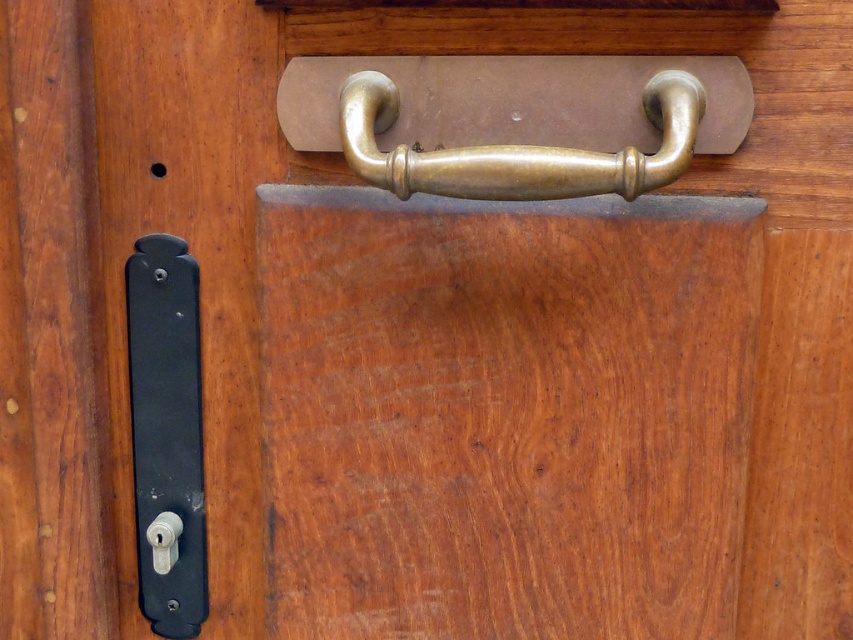
You are standing in front of a wooden door and need to open it. You see a black matte door handle at lower left and a white plastic knob at lower left. Which one should you pull to open the door?

You should pull the white plastic knob at lower left because the black matte door handle at lower left is to the left of it, indicating the knob is the one meant for opening.